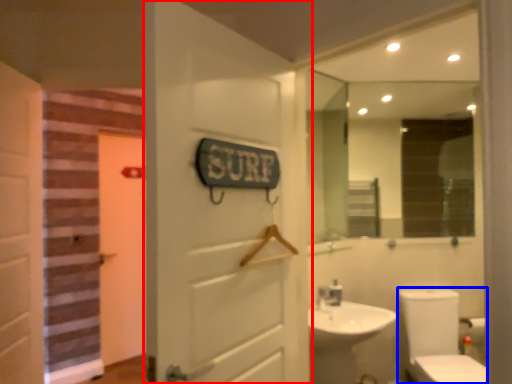
Question: Which object is closer to the camera taking this photo, door (highlighted by a red box) or toilet bowl (highlighted by a blue box)?

Choices:
 (A) door
 (B) toilet bowl

Answer: (A)